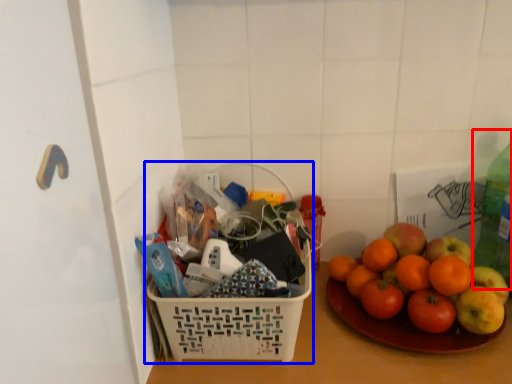
Question: Which object is closer to the camera taking this photo, bottle (highlighted by a red box) or basket (highlighted by a blue box)?

Choices:
 (A) bottle
 (B) basket

Answer: (B)